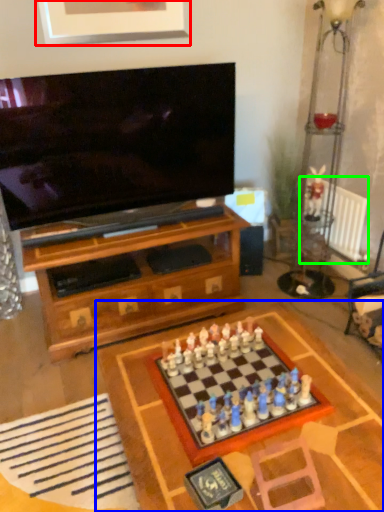
Question: Which is nearer to the picture frame (highlighted by a red box)? table (highlighted by a blue box) or radiator (highlighted by a green box).

Choices:
 (A) table
 (B) radiator

Answer: (B)